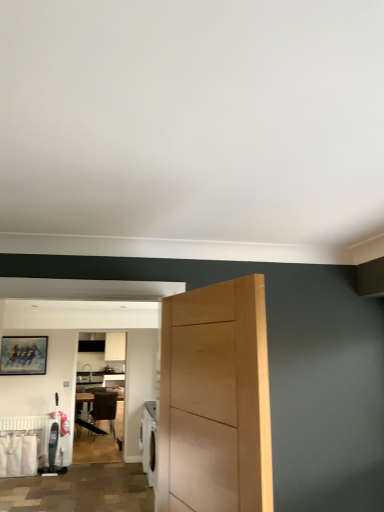
Question: From a real-world perspective, relative to white matte radiator at lower left, is light wood door at center vertically above or below?

Choices:
 (A) above
 (B) below

Answer: (A)

Question: Is point (241, 391) closer or farther from the camera than point (3, 429)?

Choices:
 (A) closer
 (B) farther

Answer: (A)

Question: Based on their relative distances, which object is nearer to the light wood door at center?

Choices:
 (A) wooden chair at center
 (B) white matte radiator at lower left
 (C) wooden table at center

Answer: (B)

Question: Considering the real-world distances, which object is closest to the light wood door at center?

Choices:
 (A) wooden table at center
 (B) white matte radiator at lower left
 (C) wooden chair at center

Answer: (B)